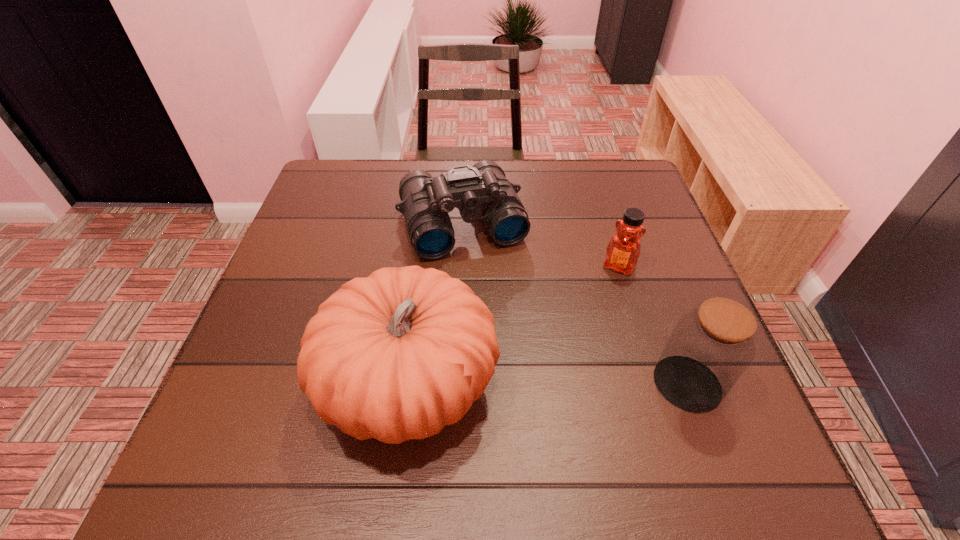
Where is `free space on the desktop that is between the pumpkin and the jar and is positioned on the front label of the honey`? The height and width of the screenshot is (540, 960). free space on the desktop that is between the pumpkin and the jar and is positioned on the front label of the honey is located at coordinates 564,384.

Image resolution: width=960 pixels, height=540 pixels. What are the coordinates of `vacant spot on the desktop that is between the pumpkin and the jar and is positioned through the lenses of the binoculars` in the screenshot? It's located at [x=524, y=384].